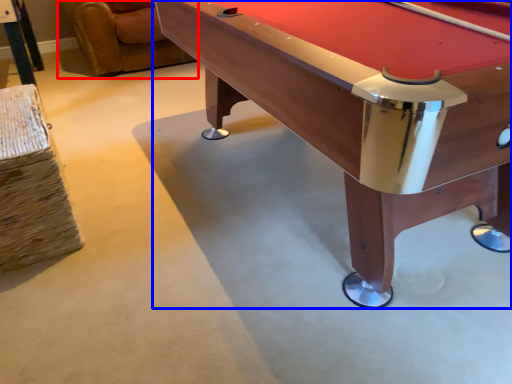
Question: Which of the following is the closest to the observer, swivel chair (highlighted by a red box) or billiard table (highlighted by a blue box)?

Choices:
 (A) swivel chair
 (B) billiard table

Answer: (B)